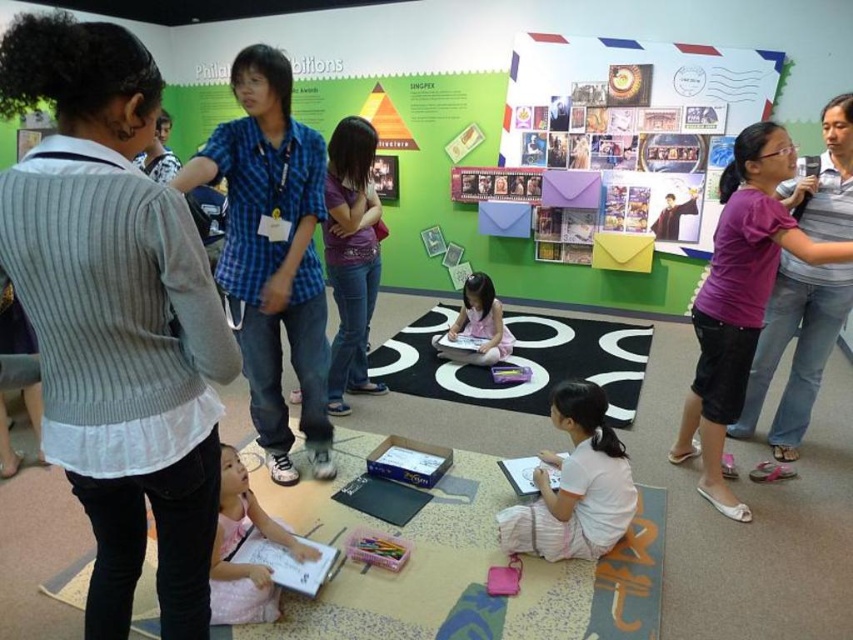
You are a photographer trying to capture a photo of the pink fabric dress at lower left without the multicolored paper at upper right appearing in the frame. Is this possible given their positions?

The multicolored paper at upper right is above the pink fabric dress at lower left, so if you position the camera below the multicolored paper at upper right, you can capture the pink fabric dress at lower left without the paper in the frame.

You are a photographer standing in the scene. You want to take a photo of the pink fabric dress at lower left without the multicolored paper at upper right appearing in the frame. Is this possible?

The pink fabric dress at lower left is behind the multicolored paper at upper right, so you can position yourself so that the multicolored paper at upper right is not in the line of sight, allowing you to capture the pink fabric dress at lower left without obstruction.